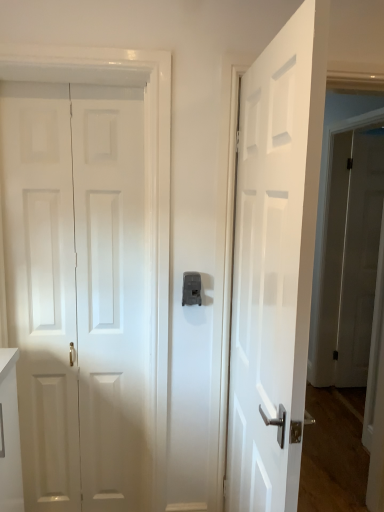
Question: Is white glossy door at center, the 2th door viewed from the left, taller or shorter than white glossy door at right, which ranks as the 3th door in left-to-right order?

Choices:
 (A) tall
 (B) short

Answer: (B)

Question: Based on their sizes in the image, would you say white glossy door at center, which is the first door from front to back, is bigger or smaller than white glossy door at right, the first door from the right?

Choices:
 (A) small
 (B) big

Answer: (B)

Question: Estimate the real-world distances between objects in this image. Which object is farther from the white glossy door at center, the 2th door viewed from the left?

Choices:
 (A) white glossy door at right, positioned as the 3th door in front-to-back order
 (B) matte gray latch at center
 (C) white matte door at left, which ranks as the 3th door in right-to-left order

Answer: (A)

Question: Estimate the real-world distances between objects in this image. Which object is closer to the white glossy door at right, positioned as the 3th door in front-to-back order?

Choices:
 (A) white glossy door at center, the 3th door positioned from the back
 (B) matte gray latch at center
 (C) white matte door at left, marked as the second door in a back-to-front arrangement

Answer: (A)